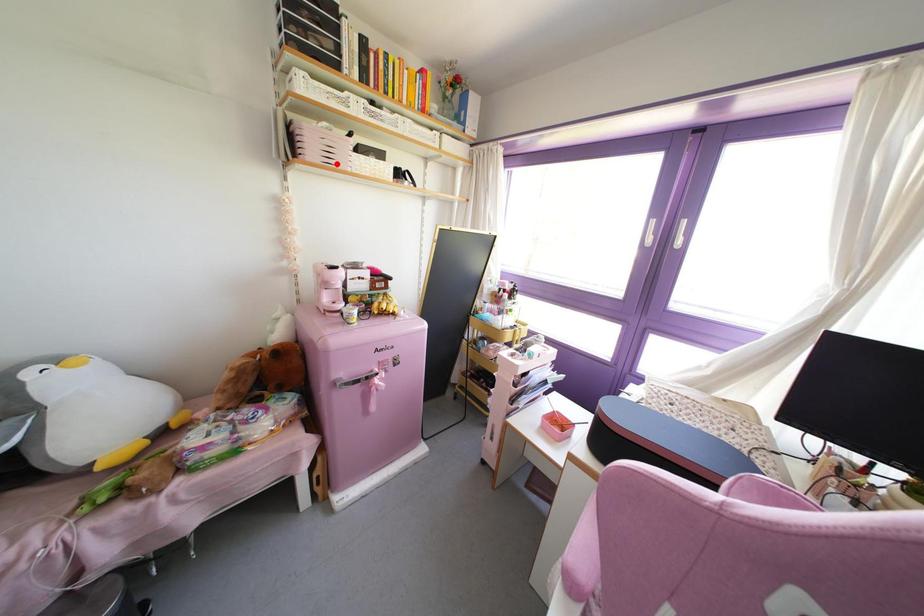
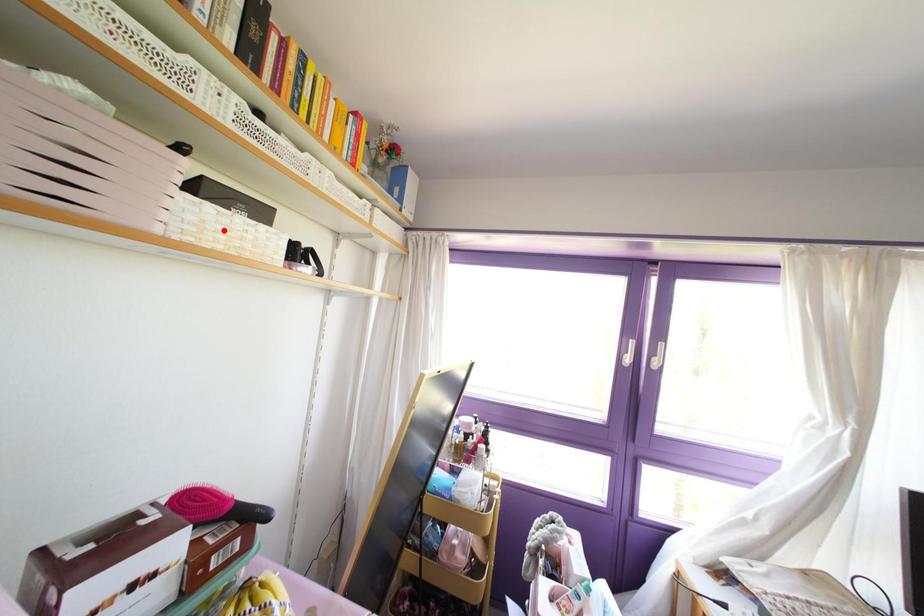
I am providing you with two images of the same scene from different viewpoints. A red point is marked on the first image and another point is marked on the second image. Does the point marked in image1 correspond to the same location as the one in image2?

No